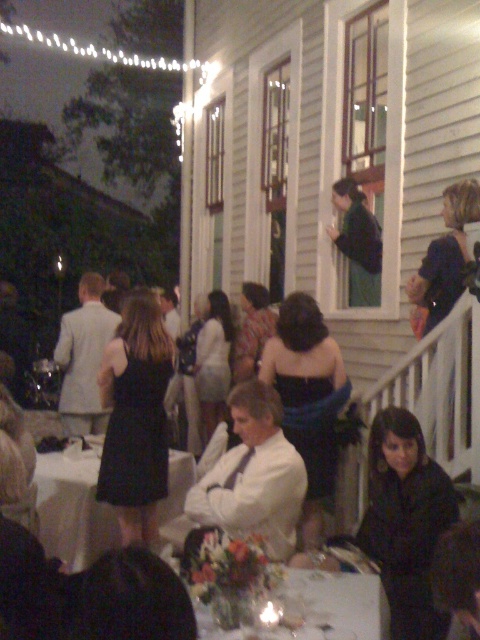
Question: Does white glossy table at center have a larger size compared to white glossy table at lower center?

Choices:
 (A) no
 (B) yes

Answer: (B)

Question: Which of the following is the farthest from the observer?

Choices:
 (A) white glossy table at lower center
 (B) white tablecloth at center
 (C) white glossy table at center
 (D) black matte dress at lower right

Answer: (C)

Question: Among these objects, which one is farthest from the camera?

Choices:
 (A) black matte dress at lower right
 (B) white tablecloth at center
 (C) white satin shirt at center
 (D) white glossy table at center

Answer: (D)

Question: Which object appears farthest from the camera in this image?

Choices:
 (A) black satin dress at center
 (B) white glossy table at lower center
 (C) white glossy table at center
 (D) white tablecloth at center

Answer: (A)

Question: Does black matte dress at lower right have a smaller size compared to white glossy table at lower center?

Choices:
 (A) yes
 (B) no

Answer: (B)

Question: Does black matte dress at lower right appear over white tablecloth at center?

Choices:
 (A) yes
 (B) no

Answer: (B)